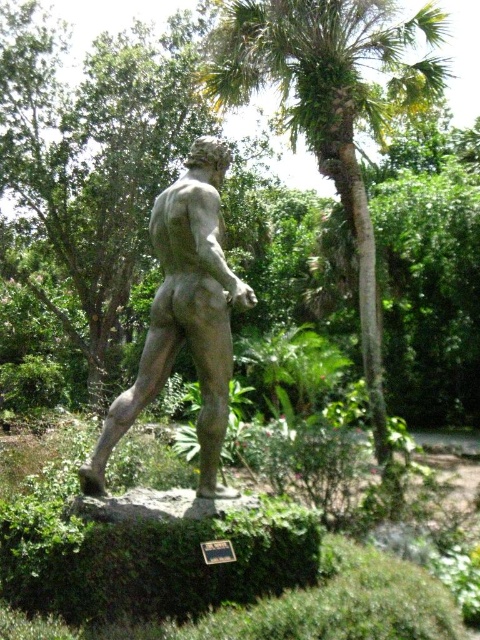
Question: Can you confirm if green leafy palm tree at center is positioned above stone statue at center?

Choices:
 (A) yes
 (B) no

Answer: (A)

Question: Which point appears closest to the camera in this image?

Choices:
 (A) (217, 244)
 (B) (384, 13)

Answer: (A)

Question: Can you confirm if green leafy palm tree at center is positioned to the right of stone statue at center?

Choices:
 (A) yes
 (B) no

Answer: (A)

Question: Can you confirm if green leafy palm tree at center is bigger than stone statue at center?

Choices:
 (A) no
 (B) yes

Answer: (A)

Question: Which object appears closest to the camera in this image?

Choices:
 (A) stone statue at center
 (B) green leafy palm tree at center

Answer: (A)